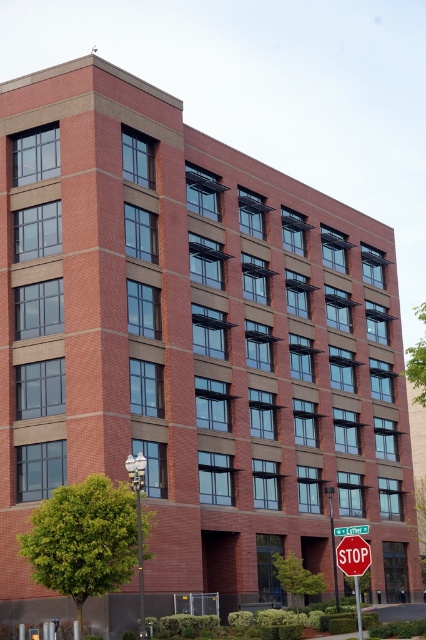
Can you confirm if red plastic stop sign at center is positioned to the right of green plastic street sign at upper center?

No, red plastic stop sign at center is not to the right of green plastic street sign at upper center.

This screenshot has height=640, width=426. In order to click on red plastic stop sign at center in this screenshot , I will do `click(353, 556)`.